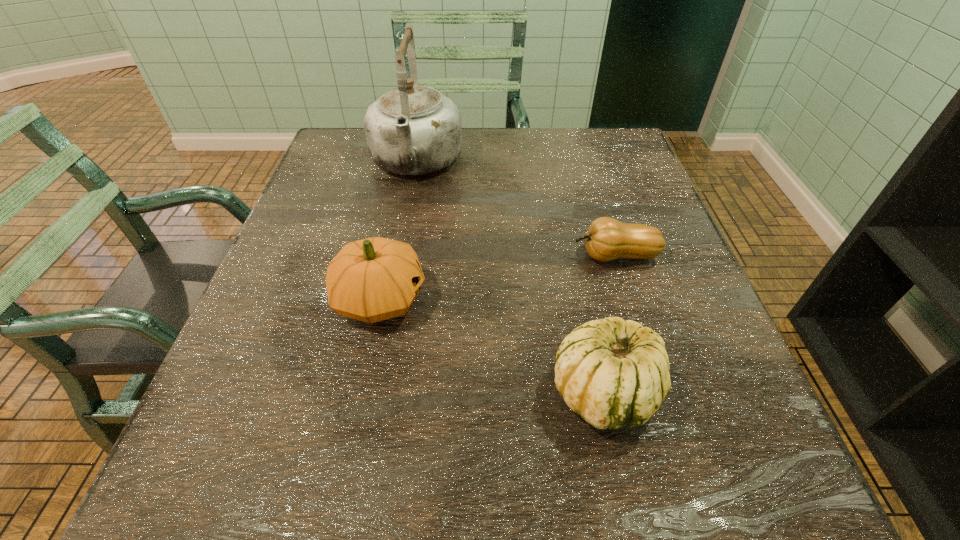
Identify which gourd is located as the second nearest to the leftmost gourd. Please provide its 2D coordinates. Your answer should be formatted as a tuple, i.e. [(x, y)], where the tuple contains the x and y coordinates of a point satisfying the conditions above.

[(607, 239)]

The height and width of the screenshot is (540, 960). Identify the location of the second closest gourd to the shortest object. (374, 279).

At what (x,y) coordinates should I click in order to perform the action: click on free region that satisfies the following two spatial constraints: 1. at the spout of the nearest object; 2. on the left side of the kettle. Please return your answer as a coordinate pair (x, y). The image size is (960, 540). Looking at the image, I should click on (373, 390).

Where is `free point that satisfies the following two spatial constraints: 1. on the side of the nearest gourd with the carved face; 2. on the right side of the leftmost gourd`? Image resolution: width=960 pixels, height=540 pixels. free point that satisfies the following two spatial constraints: 1. on the side of the nearest gourd with the carved face; 2. on the right side of the leftmost gourd is located at coordinates (361, 390).

At what (x,y) coordinates should I click in order to perform the action: click on free space that satisfies the following two spatial constraints: 1. at the spout of the farthest object; 2. on the side of the leftmost gourd with the carved face. Please return your answer as a coordinate pair (x, y). This screenshot has height=540, width=960. Looking at the image, I should click on (391, 299).

The width and height of the screenshot is (960, 540). What are the coordinates of `free space that satisfies the following two spatial constraints: 1. on the side of the nearest object with the carved face; 2. on the right side of the leftmost gourd` in the screenshot? It's located at (361, 390).

Locate an element on the screen. vacant space that satisfies the following two spatial constraints: 1. on the side of the leftmost gourd with the carved face; 2. on the left side of the nearest gourd is located at coordinates (361, 390).